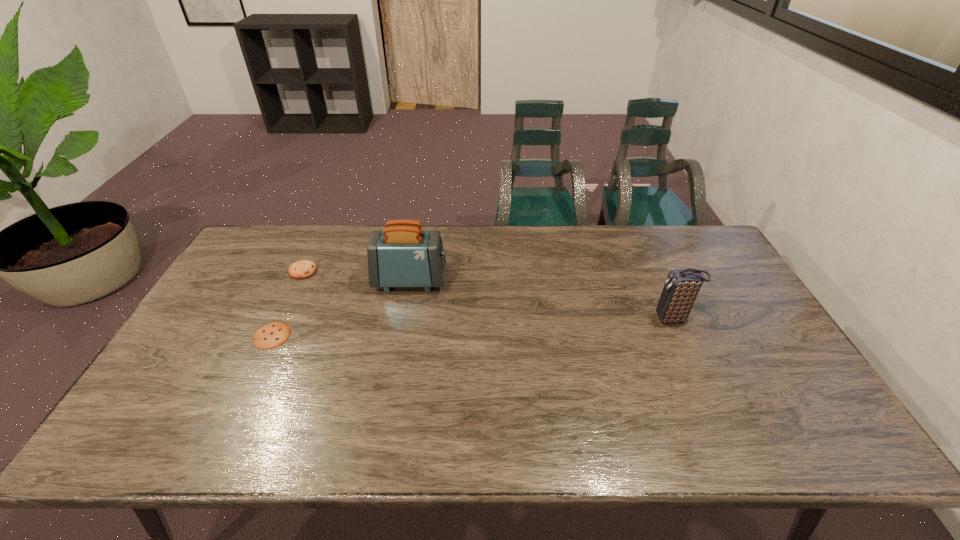
You are a GUI agent. You are given a task and a screenshot of the screen. Output one action in this format:
    pyautogui.click(x=<x>, y=<y>)
    Task: Click on the vacant space that is in between the nearer cookie and the third shortest object
    This screenshot has height=540, width=960.
    Given the screenshot: What is the action you would take?
    pyautogui.click(x=472, y=327)

Identify the location of vacant point located between the shortest object and the toaster. This screenshot has height=540, width=960. (341, 308).

Image resolution: width=960 pixels, height=540 pixels. In order to click on unoccupied area between the rightmost object and the taller cookie in this screenshot , I will do `click(488, 295)`.

Locate an element on the screen. Image resolution: width=960 pixels, height=540 pixels. blank region between the taller cookie and the shortest object is located at coordinates (287, 303).

The height and width of the screenshot is (540, 960). What are the coordinates of `free spot between the shorter cookie and the farther cookie` in the screenshot? It's located at (287, 303).

Where is `vacant area that lies between the rightmost object and the second shortest object`? Image resolution: width=960 pixels, height=540 pixels. vacant area that lies between the rightmost object and the second shortest object is located at coordinates (488, 295).

Find the location of a particular element. free space between the taller cookie and the shorter cookie is located at coordinates (287, 303).

Locate an element on the screen. Image resolution: width=960 pixels, height=540 pixels. vacant space in between the shorter cookie and the rightmost object is located at coordinates (472, 327).

You are a GUI agent. You are given a task and a screenshot of the screen. Output one action in this format:
    pyautogui.click(x=<x>, y=<y>)
    Task: Click on the blank region between the toaster and the second shortest object
    This screenshot has width=960, height=540.
    Given the screenshot: What is the action you would take?
    pyautogui.click(x=356, y=275)

What are the coordinates of `free space between the taller cookie and the rightmost object` in the screenshot? It's located at (488, 295).